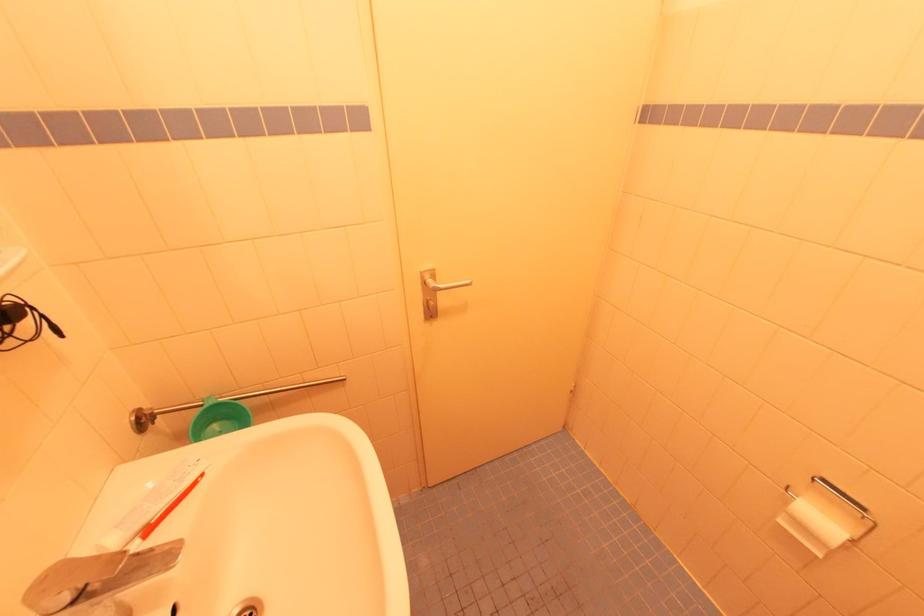
Find where to lift the green plastic cup. Please return your answer as a coordinate pair (x, y).

(217, 419)